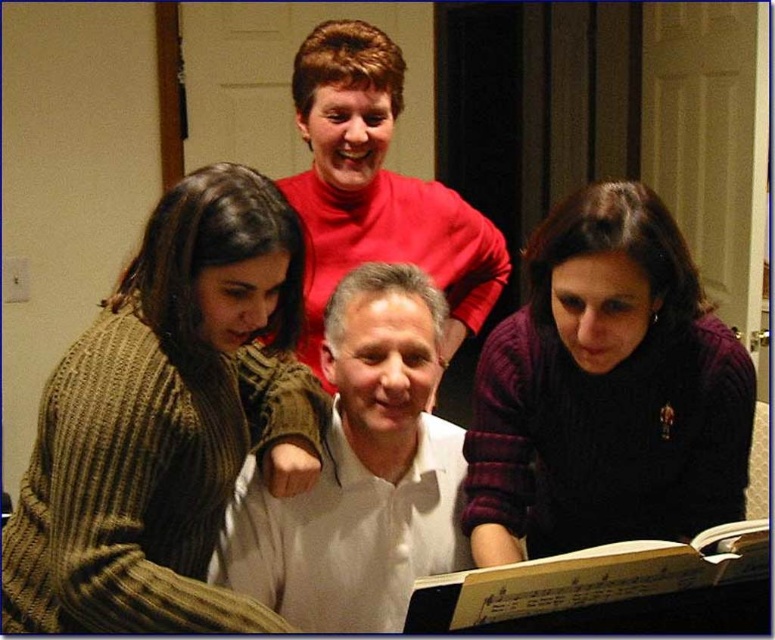
You are standing in the room and see a point at coordinates (605, 392). According to the scene, what object or person is located at that point?

The point at coordinates (605, 392) is on the dark purple sweater at lower right.

You are trying to decide which clothing item to grab quickly from the floor. The dark purple sweater at lower right and the matte red turtleneck at upper center are both on the floor. Which one can you reach without bending down much?

The dark purple sweater at lower right has a lesser height compared to matte red turtleneck at upper center, so you can reach it without bending down much.

You are a photographer trying to capture a group photo of the white matte shirt at center and the matte red turtleneck at upper center. Since you want to ensure both are clearly visible, which person should you position closer to the camera to avoid being cut off?

The white matte shirt at center has a smaller width than the matte red turtleneck at upper center. To ensure both are visible, position the white matte shirt at center closer to the camera since its narrower width requires less space, allowing the wider matte red turtleneck at upper center to fit without being cut off.